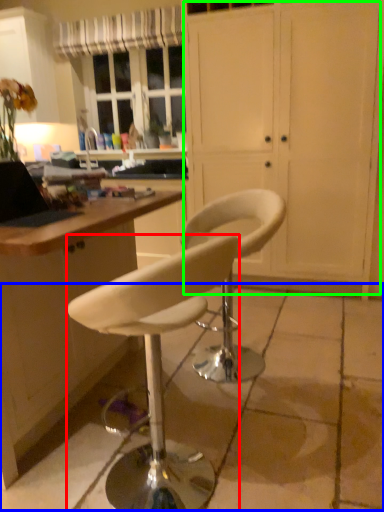
Question: Considering the real-world distances, which object is closest to chair (highlighted by a red box)? concrete (highlighted by a blue box) or screen door (highlighted by a green box).

Choices:
 (A) concrete
 (B) screen door

Answer: (A)